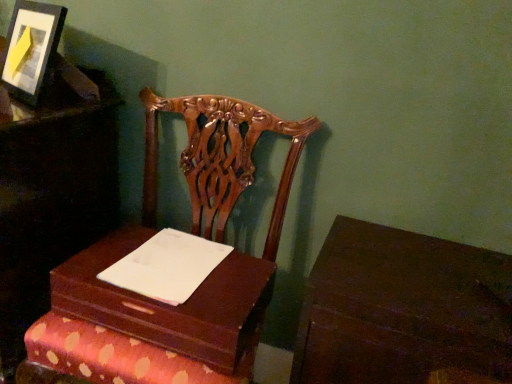
The height and width of the screenshot is (384, 512). I want to click on vacant space to the right of white paper at center, so click(x=234, y=282).